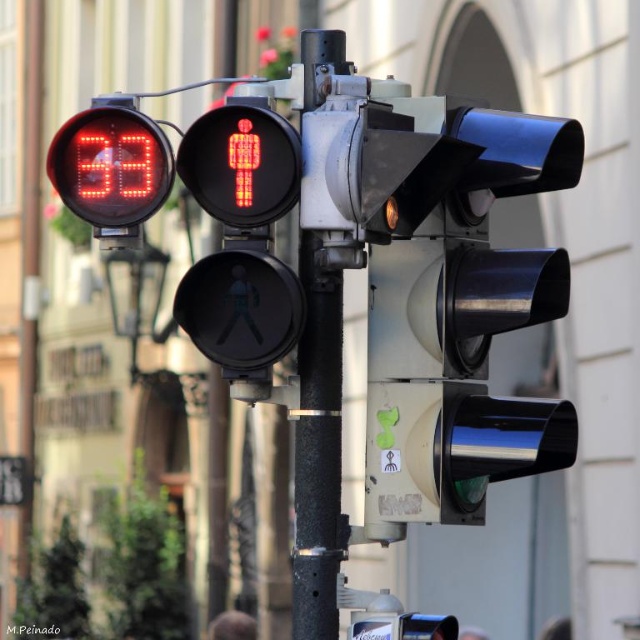
Is point (301, 608) positioned after point (109, 131)?

Yes, point (301, 608) is behind point (109, 131).

Does black metal pole at center have a lesser height compared to red led display at upper left?

No, black metal pole at center is not shorter than red led display at upper left.

At what (x,y) coordinates should I click in order to perform the action: click on black metal pole at center. Please return your answer as a coordinate pair (x, y). This screenshot has width=640, height=640. Looking at the image, I should click on (317, 438).

Identify the location of black metal pole at center. (317, 438).

Can you confirm if red led display at upper left is shorter than metallic rectangular sign at lower left?

Correct, red led display at upper left is not as tall as metallic rectangular sign at lower left.

Does point (134, 115) come in front of point (6, 483)?

That is True.

What do you see at coordinates (109, 166) in the screenshot?
I see `red led display at upper left` at bounding box center [109, 166].

The width and height of the screenshot is (640, 640). Identify the location of red led display at upper left. (109, 166).

Is point (452, 232) closer to viewer compared to point (120, 138)?

No, it is behind (120, 138).

Is metallic traffic light at center closer to the viewer compared to red led display at upper left?

Yes, it is.

This screenshot has width=640, height=640. Describe the element at coordinates (464, 326) in the screenshot. I see `metallic traffic light at center` at that location.

Where is `metallic traffic light at center`? The width and height of the screenshot is (640, 640). metallic traffic light at center is located at coordinates (464, 326).